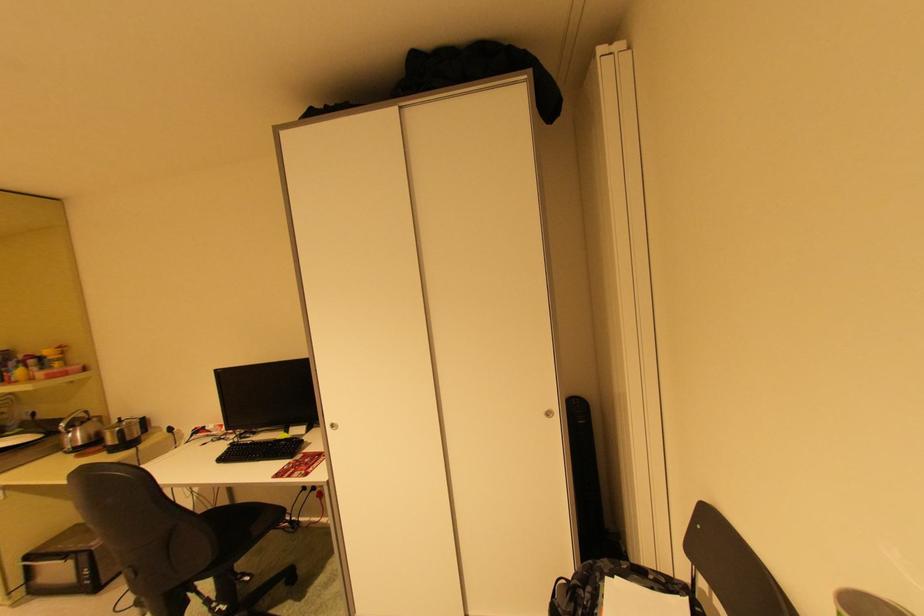
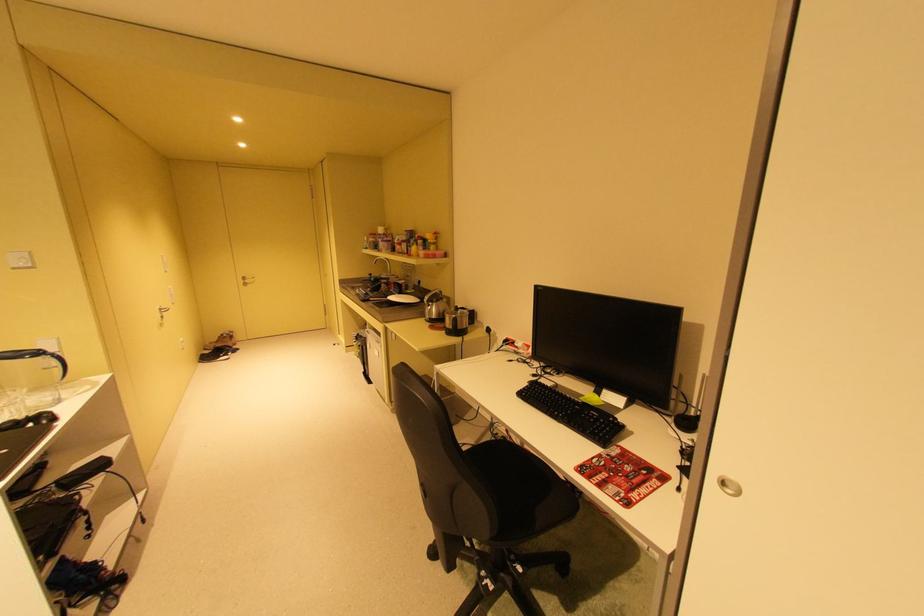
In the second image, find the point that corresponds to point (127, 442) in the first image.

(460, 328)